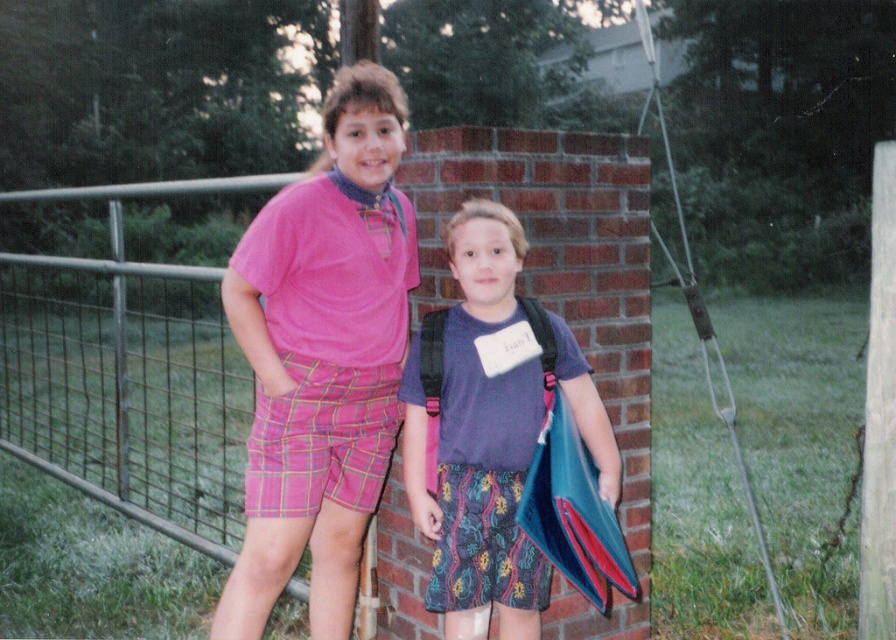
Question: Does matte pink shirt at center appear on the left side of matte purple shirt at center?

Choices:
 (A) yes
 (B) no

Answer: (A)

Question: Is matte pink shirt at center positioned behind matte purple shirt at center?

Choices:
 (A) no
 (B) yes

Answer: (A)

Question: Which object appears farthest from the camera in this image?

Choices:
 (A) matte purple shirt at center
 (B) matte pink shirt at center

Answer: (A)

Question: Which point is farther to the camera?

Choices:
 (A) (419, 356)
 (B) (250, 552)

Answer: (B)

Question: Does matte pink shirt at center lie behind matte purple shirt at center?

Choices:
 (A) no
 (B) yes

Answer: (A)

Question: Which object is farther from the camera taking this photo?

Choices:
 (A) matte pink shirt at center
 (B) matte purple shirt at center

Answer: (B)